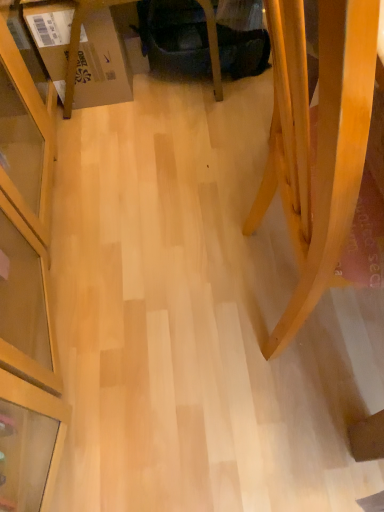
Question: In the image, is light wood chair at lower right positioned in front of or behind velvet dark blue swivel chair at center?

Choices:
 (A) behind
 (B) front

Answer: (B)

Question: From a real-world perspective, is light wood chair at lower right positioned above or below velvet dark blue swivel chair at center?

Choices:
 (A) below
 (B) above

Answer: (B)

Question: Estimate the real-world distances between objects in this image. Which object is closer to the velvet dark blue swivel chair at center?

Choices:
 (A) light wood chair at lower right
 (B) cardboard box at left

Answer: (B)

Question: Estimate the real-world distances between objects in this image. Which object is farther from the light wood chair at lower right?

Choices:
 (A) cardboard box at left
 (B) velvet dark blue swivel chair at center

Answer: (A)